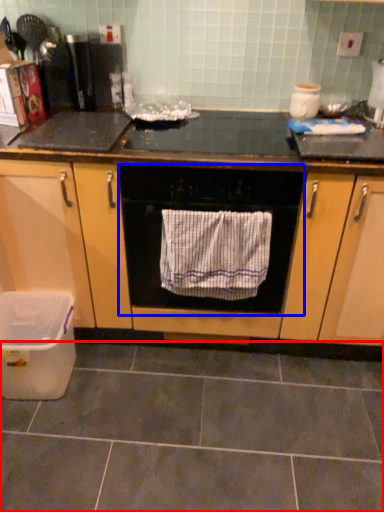
Question: Which object appears farthest to the camera in this image, ceramic tile (highlighted by a red box) or home appliance (highlighted by a blue box)?

Choices:
 (A) ceramic tile
 (B) home appliance

Answer: (B)